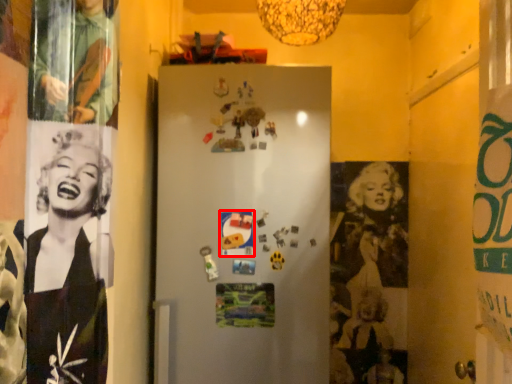
Question: From the image's perspective, where is poster page (annotated by the red box) located in relation to poster page in the image?

Choices:
 (A) above
 (B) below

Answer: (A)